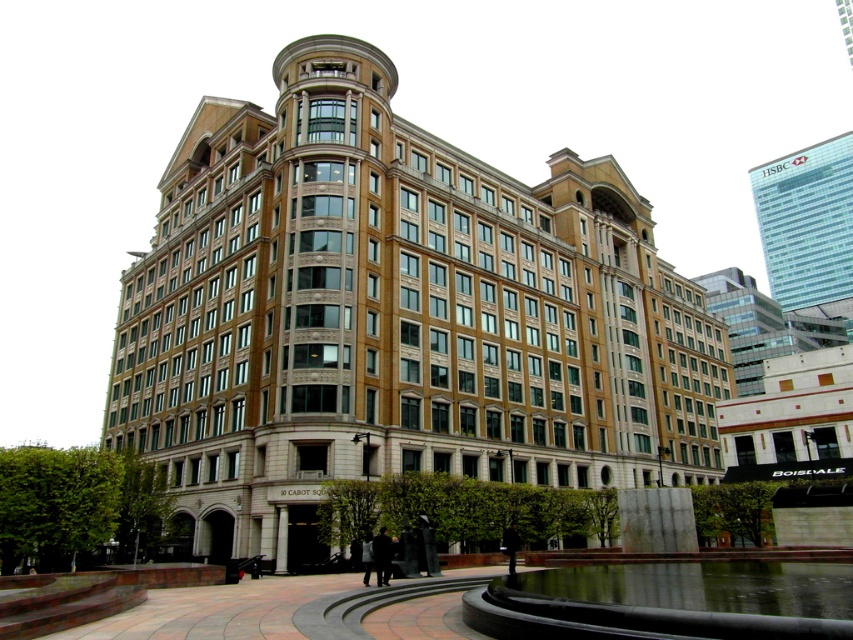
Between brown stone building at center and glassy reflective skyscraper at upper right, which one appears on the left side from the viewer's perspective?

Positioned to the left is brown stone building at center.

In the scene shown: Between brown stone building at center and glassy reflective skyscraper at upper right, which one is positioned higher?

glassy reflective skyscraper at upper right is higher up.

Does point (230, 525) come farther from viewer compared to point (791, 266)?

No, (230, 525) is closer to viewer.

Image resolution: width=853 pixels, height=640 pixels. I want to click on brown stone building at center, so tap(393, 316).